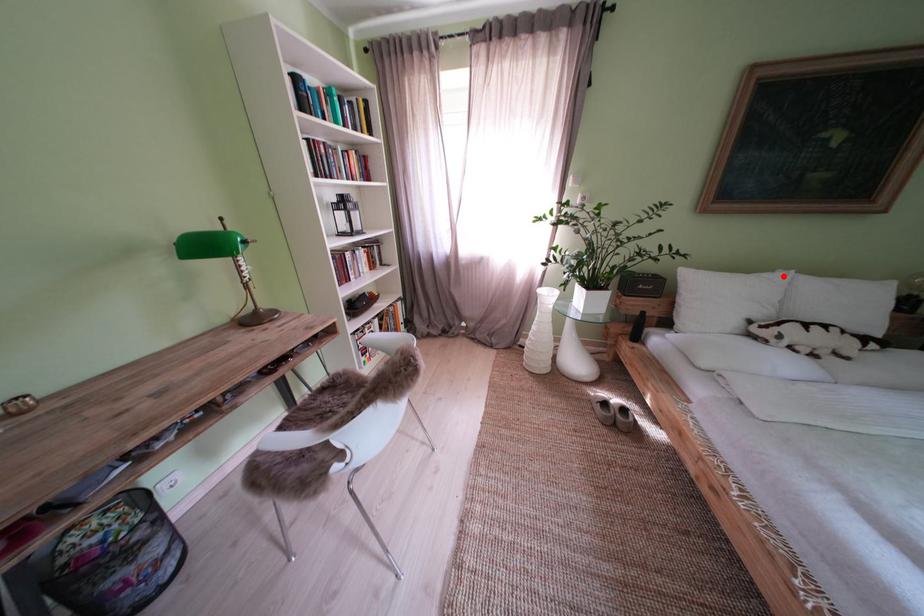
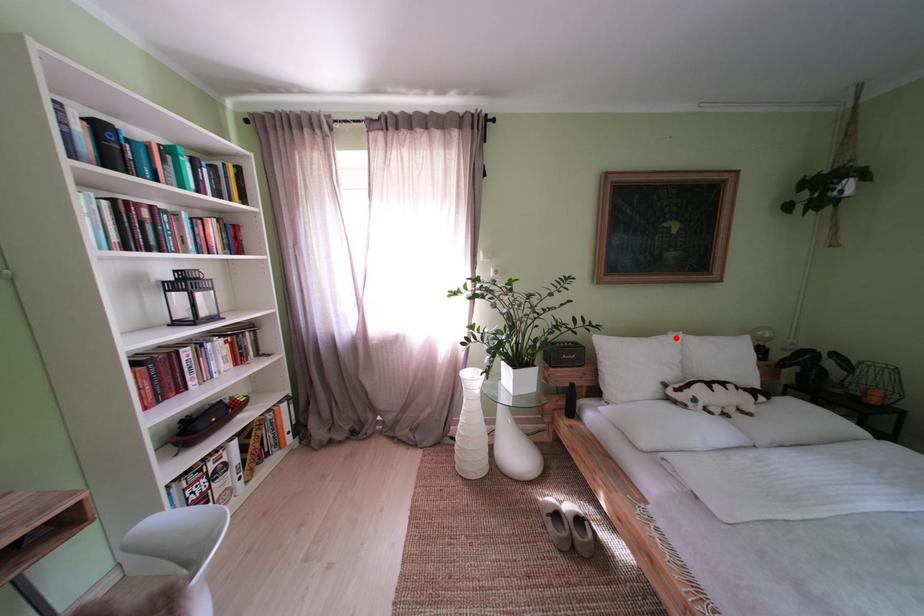
I am providing you with two images of the same scene from different viewpoints. A red point is marked on the first image and another point is marked on the second image. Are the points marked in image1 and image2 representing the same 3D position?

Yes